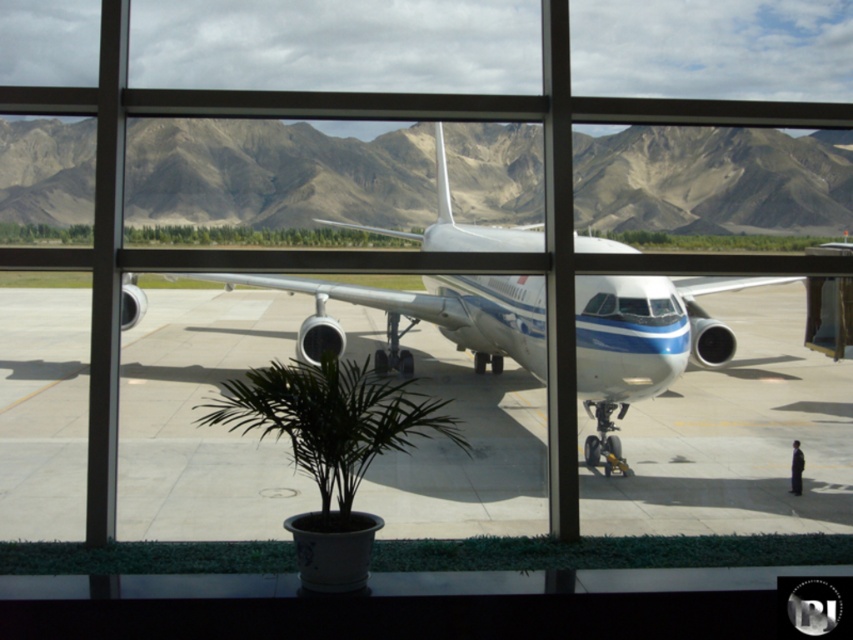
You are standing inside an airport terminal and looking through the window. You want to know how far the gray concrete tarmac at center is from you. Can you determine the distance?

The gray concrete tarmac at center is 7.65 meters away from the viewer.

You are standing inside an airport terminal and looking through the large windows. You see the gray concrete tarmac at center and the white glossy airplane at center. Which object is positioned to the left side of the other?

The gray concrete tarmac at center is to the left of the white glossy airplane at center, so the gray concrete tarmac at center is positioned to the left side of the white glossy airplane at center.

You are standing in the airport terminal looking through the window. There are two points marked on the window at coordinates point (x=811, y=358) and point (x=712, y=326). Which point is closer to you?

Point (x=712, y=326) is closer to you because it is less further to the viewer than point (x=811, y=358).